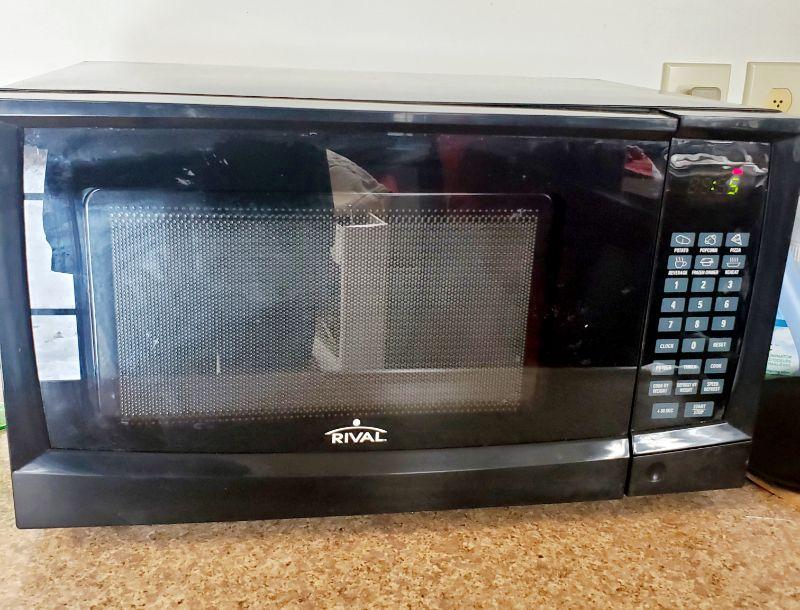
At what (x,y) coordinates should I click in order to perform the action: click on microwave. Please return your answer as a coordinate pair (x, y). Image resolution: width=800 pixels, height=610 pixels. Looking at the image, I should click on (670, 210).